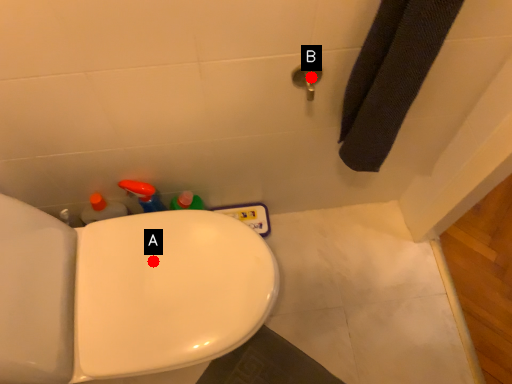
Question: Two points are circled on the image, labeled by A and B beside each circle. Among these points, which one is farthest from the camera?

Choices:
 (A) A is further
 (B) B is further

Answer: (A)